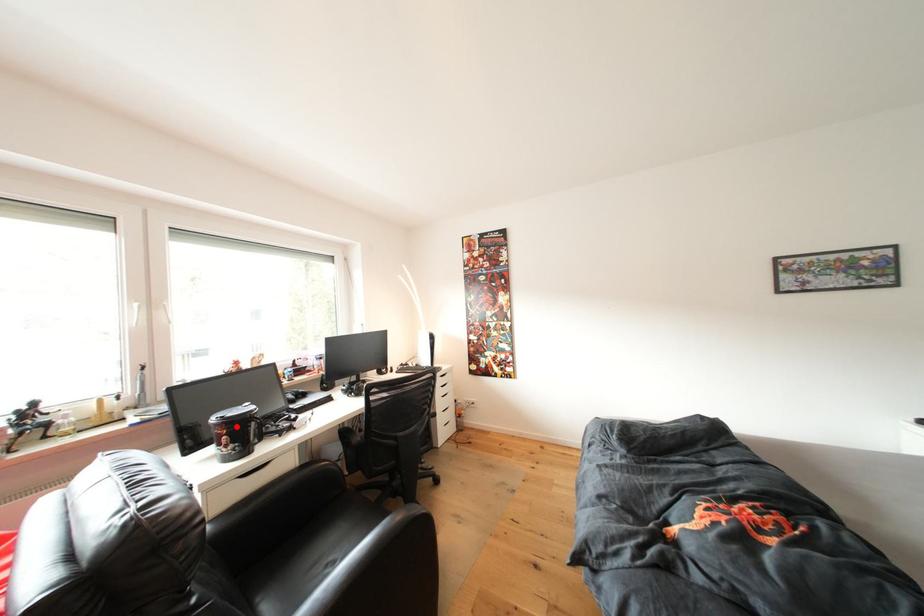
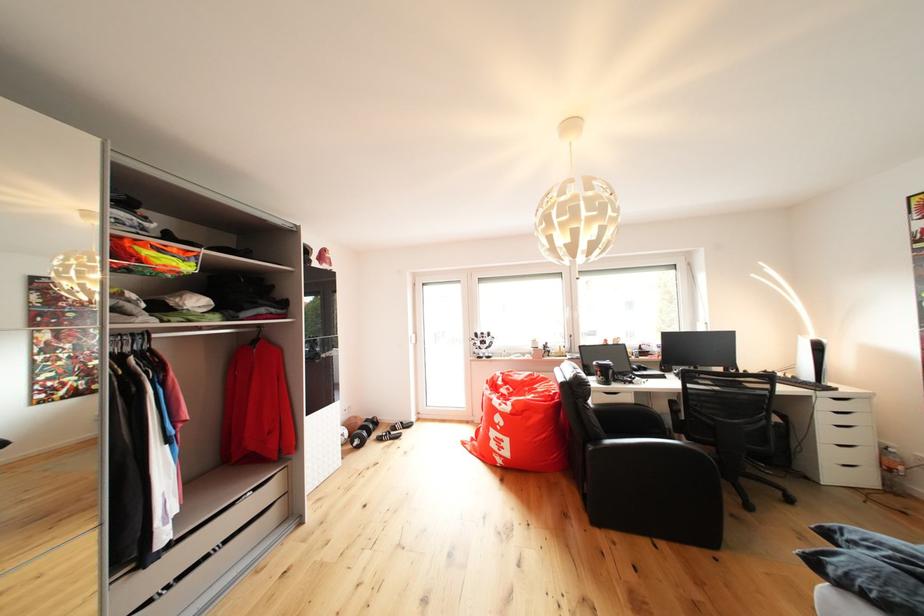
Find the pixel in the second image that matches the highlighted location in the first image.

(609, 371)